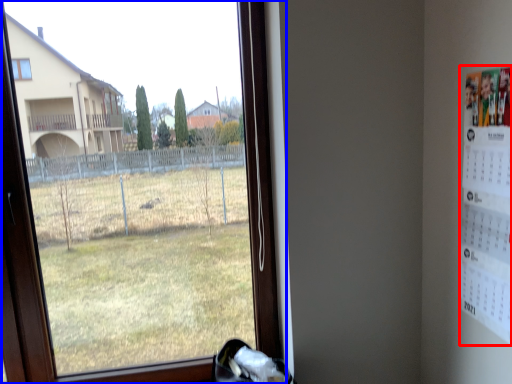
Question: Among these objects, which one is farthest to the camera, poster (highlighted by a red box) or window (highlighted by a blue box)?

Choices:
 (A) poster
 (B) window

Answer: (B)